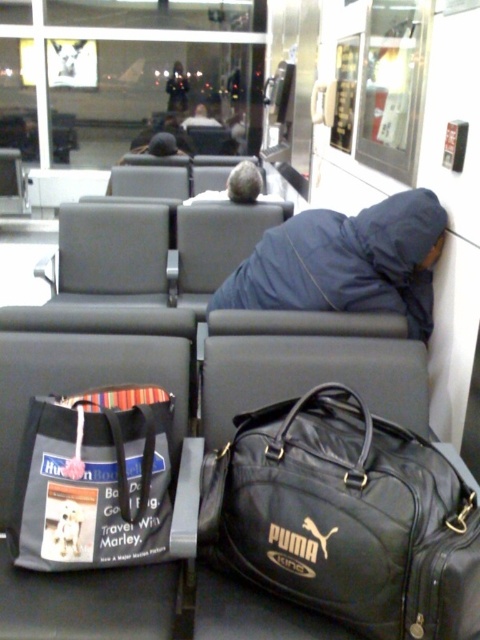
Question: Which object is farther from the camera taking this photo?

Choices:
 (A) black leather duffel at center
 (B) blue fabric person at center

Answer: (B)

Question: Does black leather duffel at center have a smaller size compared to blue fabric person at center?

Choices:
 (A) no
 (B) yes

Answer: (B)

Question: Does gray fabric tote bag at lower left appear on the right side of blue fabric person at center?

Choices:
 (A) yes
 (B) no

Answer: (B)

Question: Which point is farther from the camera taking this photo?

Choices:
 (A) (276, 520)
 (B) (409, 204)
 (C) (142, 556)

Answer: (B)

Question: Is gray fabric tote bag at lower left to the right of blue fabric person at center from the viewer's perspective?

Choices:
 (A) no
 (B) yes

Answer: (A)

Question: Which is farther from the gray fabric tote bag at lower left?

Choices:
 (A) blue fabric person at center
 (B) black leather duffel at center

Answer: (A)